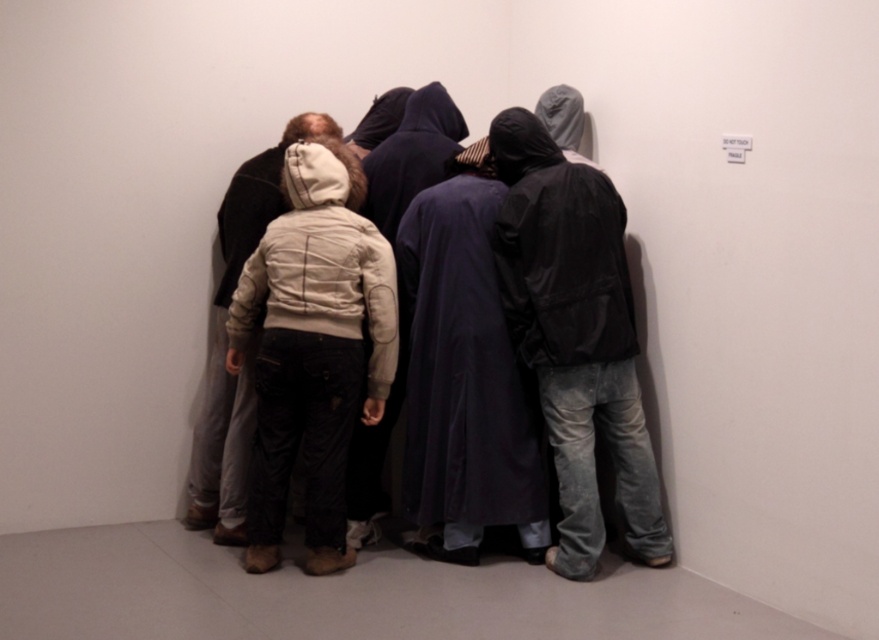
Question: Can you confirm if matte black jacket at center is bigger than light beige jacket at center?

Choices:
 (A) no
 (B) yes

Answer: (A)

Question: Can you confirm if matte black jacket at center is positioned below light beige jacket at center?

Choices:
 (A) no
 (B) yes

Answer: (B)

Question: Considering the relative positions of matte black jacket at center and light beige jacket at center in the image provided, where is matte black jacket at center located with respect to light beige jacket at center?

Choices:
 (A) right
 (B) left

Answer: (A)

Question: Which object is closer to the camera taking this photo?

Choices:
 (A) light beige jacket at center
 (B) matte black jacket at center

Answer: (B)

Question: Which object appears closest to the camera in this image?

Choices:
 (A) light beige jacket at center
 (B) matte black jacket at center

Answer: (B)